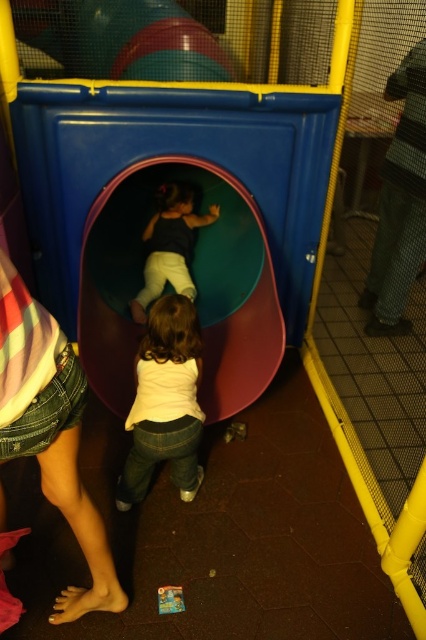
Question: Can you confirm if green rubber slide at center is positioned to the left of white matte shirt at center?

Choices:
 (A) yes
 (B) no

Answer: (A)

Question: Can you confirm if denim shorts at lower left is positioned below white matte shirt at center?

Choices:
 (A) yes
 (B) no

Answer: (A)

Question: Which point is farther to the camera?

Choices:
 (A) matte black shirt at center
 (B) green rubber slide at center
 (C) white matte shirt at center
 (D) denim shorts at lower left

Answer: (A)

Question: Which point is farther from the camera taking this photo?

Choices:
 (A) (230, 186)
 (B) (172, 200)
 (C) (55, 396)

Answer: (B)

Question: Which is nearer to the matte black shirt at center?

Choices:
 (A) green rubber slide at center
 (B) denim shorts at lower left

Answer: (A)

Question: Can you confirm if green rubber slide at center is smaller than denim shorts at lower left?

Choices:
 (A) no
 (B) yes

Answer: (A)